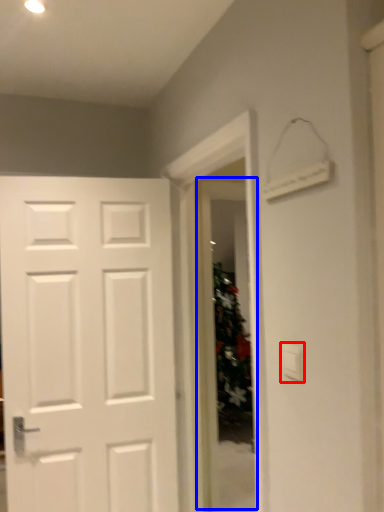
Question: Which point is closer to the camera, light switch (highlighted by a red box) or glass door (highlighted by a blue box)?

Choices:
 (A) light switch
 (B) glass door

Answer: (A)